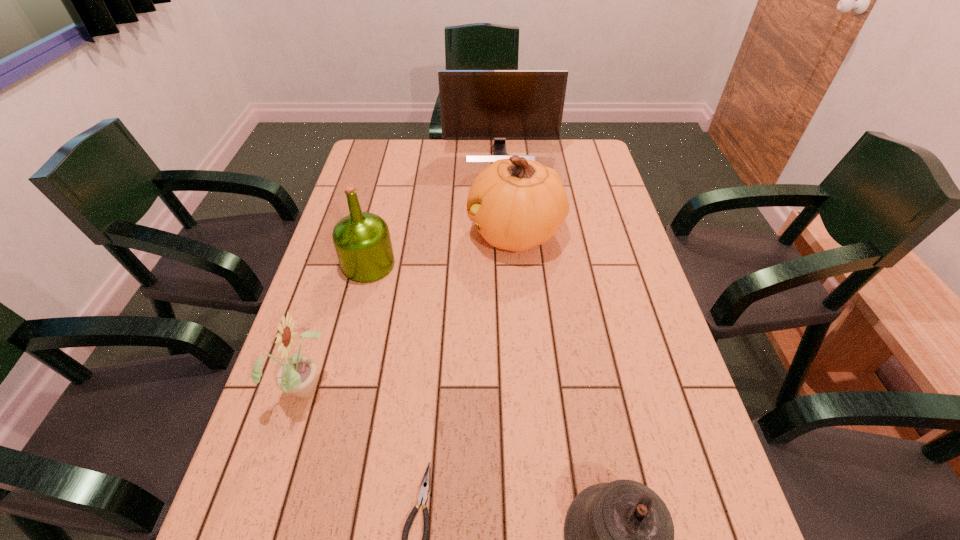
This screenshot has width=960, height=540. What are the coordinates of `object that is at the far edge` in the screenshot? It's located at (499, 105).

Locate an element on the screen. The image size is (960, 540). olive oil that is at the left edge is located at coordinates pyautogui.click(x=362, y=241).

Image resolution: width=960 pixels, height=540 pixels. Find the location of `sunflower that is at the left edge`. sunflower that is at the left edge is located at coordinates (297, 375).

Identify the location of object present at the right edge. The height and width of the screenshot is (540, 960). (499, 105).

This screenshot has height=540, width=960. In order to click on object that is positioned at the far right corner in this screenshot , I will do `click(499, 105)`.

In the image, there is a desktop. Identify the location of vacant space at the far edge. (559, 165).

In the image, there is a desktop. Where is `vacant space at the left edge`? The width and height of the screenshot is (960, 540). vacant space at the left edge is located at coordinates pyautogui.click(x=225, y=532).

Image resolution: width=960 pixels, height=540 pixels. Identify the location of free location at the right edge. (637, 412).

Locate an element on the screen. The height and width of the screenshot is (540, 960). free area in between the olive oil and the sunflower is located at coordinates (336, 326).

You are a GUI agent. You are given a task and a screenshot of the screen. Output one action in this format:
    pyautogui.click(x=<x>, y=<y>)
    Task: Click on the second closest object relative to the fourth farthest object
    The width and height of the screenshot is (960, 540).
    Given the screenshot: What is the action you would take?
    pyautogui.click(x=362, y=241)